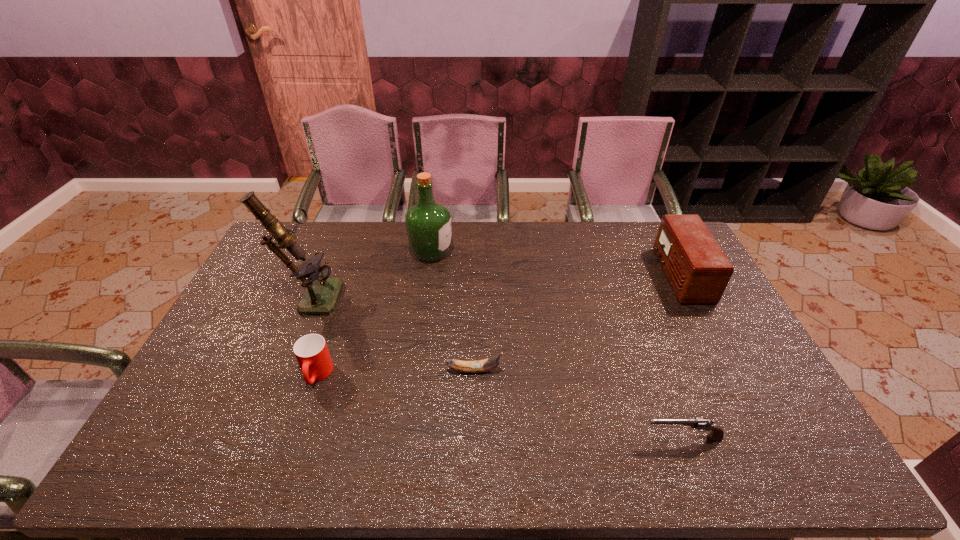
The image size is (960, 540). What are the coordinates of `radio receiver that is at the far edge` in the screenshot? It's located at (698, 270).

Find the location of a particular element. The image size is (960, 540). object positioned at the near edge is located at coordinates (717, 433).

Image resolution: width=960 pixels, height=540 pixels. In order to click on object that is at the left edge in this screenshot , I will do `click(321, 293)`.

This screenshot has height=540, width=960. I want to click on object that is at the right edge, so click(x=698, y=270).

At what (x,y) coordinates should I click in order to perform the action: click on object located in the far right corner section of the desktop. Please return your answer as a coordinate pair (x, y). Looking at the image, I should click on (698, 270).

At what (x,y) coordinates should I click in order to perform the action: click on free location at the far edge of the desktop. Please return your answer as a coordinate pair (x, y). This screenshot has width=960, height=540. Looking at the image, I should click on (477, 250).

You are a GUI agent. You are given a task and a screenshot of the screen. Output one action in this format:
    pyautogui.click(x=<x>, y=<y>)
    Task: Click on the free region at the left edge of the desktop
    
    Given the screenshot: What is the action you would take?
    pyautogui.click(x=239, y=359)

Locate an element on the screen. vacant position at the far left corner of the desktop is located at coordinates (293, 225).

The width and height of the screenshot is (960, 540). Find the location of `blank region between the rightmost object and the liquor`. blank region between the rightmost object and the liquor is located at coordinates (x=556, y=264).

Where is `vacant region between the cup and the gun`? Image resolution: width=960 pixels, height=540 pixels. vacant region between the cup and the gun is located at coordinates (500, 406).